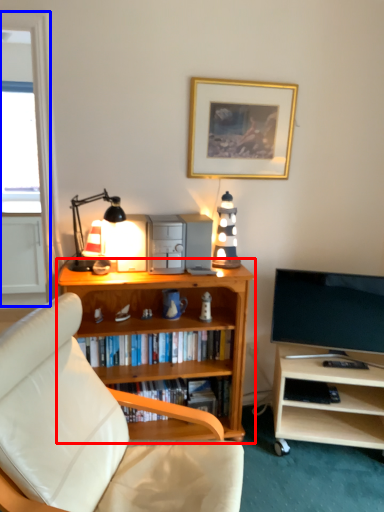
Question: Which object appears closest to the camera in this image, bookcase (highlighted by a red box) or glass door (highlighted by a blue box)?

Choices:
 (A) bookcase
 (B) glass door

Answer: (B)